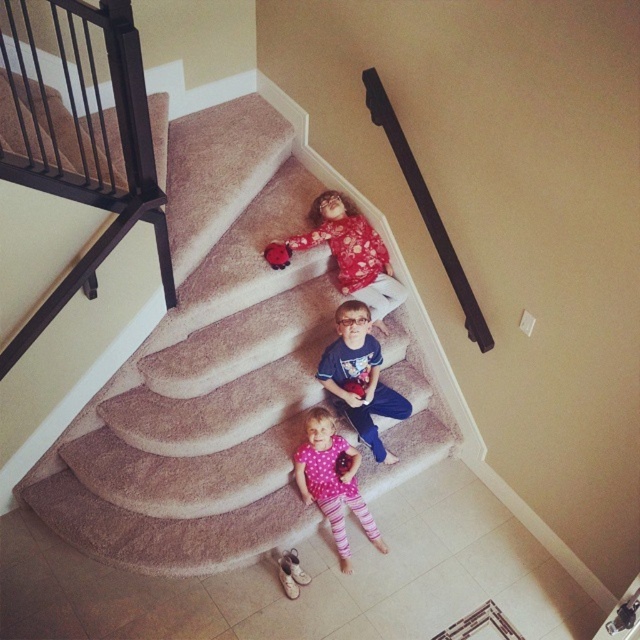
Question: Can you confirm if carpeted stairs at center is positioned above matte red plush toy at upper center?

Choices:
 (A) yes
 (B) no

Answer: (B)

Question: Can you confirm if carpeted stairs at center is wider than black metal balustrade at upper left?

Choices:
 (A) yes
 (B) no

Answer: (A)

Question: Which point appears closest to the camera in this image?

Choices:
 (A) (188, 470)
 (B) (371, 365)

Answer: (A)

Question: Which of the following is the farthest from the observer?

Choices:
 (A) carpeted stairs at center
 (B) black metal balustrade at upper left
 (C) matte floral dress at center
 (D) blue cotton shirt at center

Answer: (C)

Question: Which object is the closest to the black metal balustrade at upper left?

Choices:
 (A) matte floral dress at center
 (B) matte red plush toy at upper center
 (C) carpeted stairs at center

Answer: (C)

Question: Is blue cotton shirt at center thinner than matte red plush toy at upper center?

Choices:
 (A) no
 (B) yes

Answer: (A)